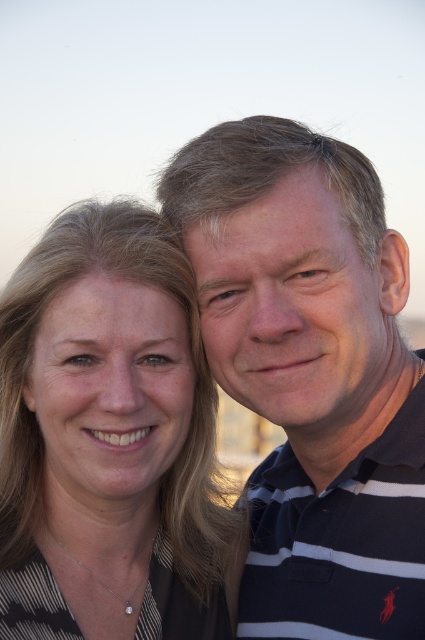
You are a photographer adjusting your camera settings to focus on two specific points in the image. The points are labeled as point 1 at coordinates point (195, 141) and point 2 at coordinates point (102, 332). Which point should you focus on first if you want to ensure both points are in focus?

You should focus on point (195, 141) first because it is closer to the camera than point (102, 332). By focusing on the closer point, the depth of field may extend to include the farther point as well, ensuring both are in focus.

You are a photographer trying to capture a group photo of two people wearing striped polo shirts. The subjects are currently positioned such that the matte striped polo shirt at center is 34.06 inches away from the dark blue striped polo shirt at right. If your camera has a minimum focus distance of 30 inches, will you be able to clearly capture both subjects in focus?

The matte striped polo shirt at center is 34.06 inches away from the dark blue striped polo shirt at right. Since the distance between them is greater than the camera minimum focus distance of 30 inches, both subjects will be in focus.

You are a photographer trying to capture a closeup shot of the matte striped polo shirt at center. Given that your camera can focus on objects within 5 meters, will you be able to take the closeup?

The matte striped polo shirt at center is 10.41 meters from the camera, which is beyond the 5 meter focus range. You will need to move closer or use a different camera setting to capture the closeup.